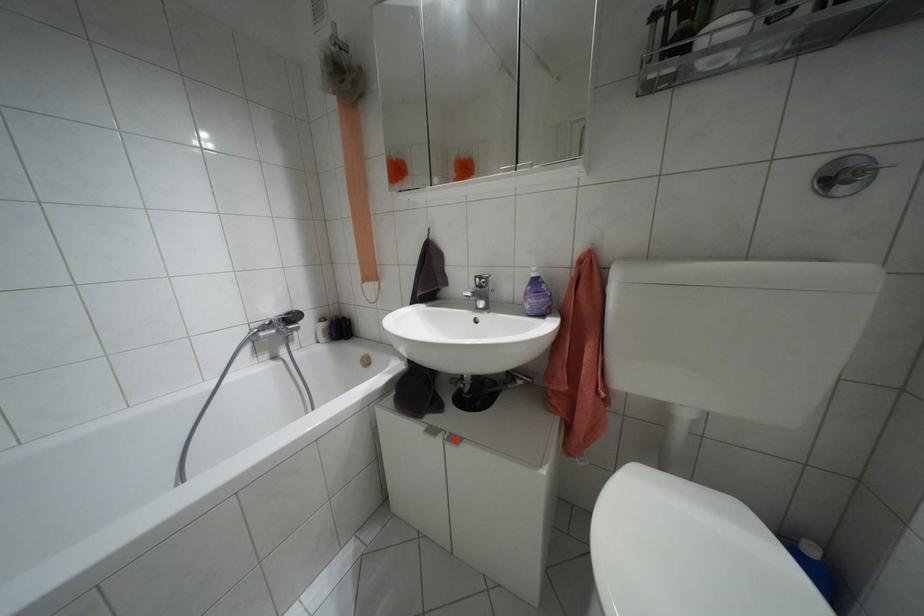
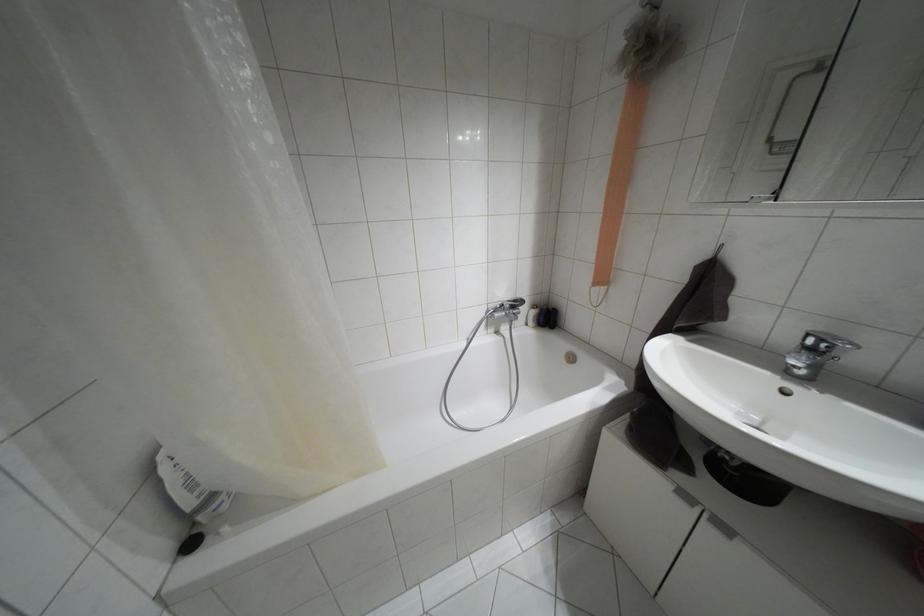
The point at the highlighted location is marked in the first image. Where is the corresponding point in the second image?

(723, 528)